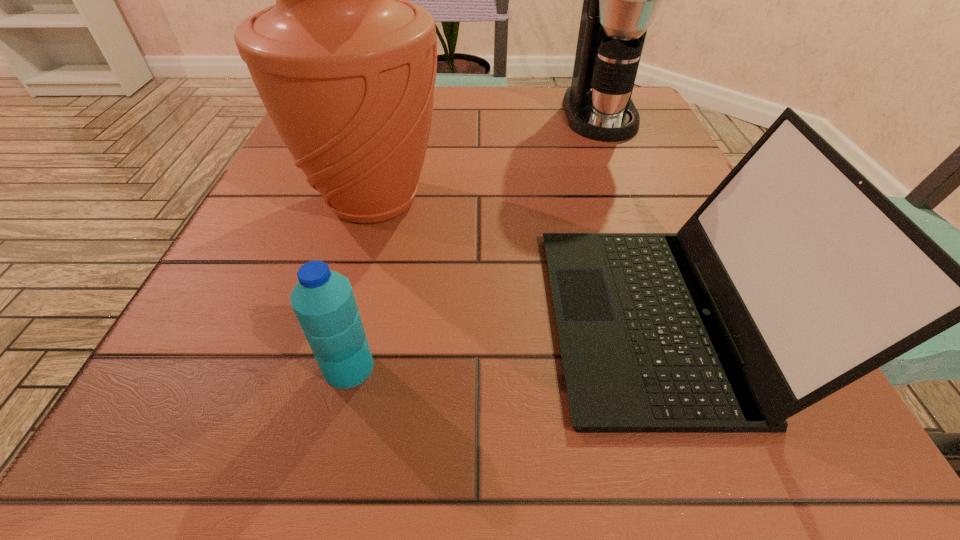
Image resolution: width=960 pixels, height=540 pixels. Find the location of `the farthest object`. the farthest object is located at coordinates (620, 0).

Identify the location of vase. (346, 67).

Locate an element on the screen. The width and height of the screenshot is (960, 540). laptop is located at coordinates (796, 277).

Locate an element on the screen. Image resolution: width=960 pixels, height=540 pixels. water bottle is located at coordinates (323, 301).

This screenshot has width=960, height=540. Find the location of `free point located 0.250m place cup under the spout of the farthest object`. free point located 0.250m place cup under the spout of the farthest object is located at coordinates (641, 219).

Locate an element on the screen. free space located on the front of the vase is located at coordinates (323, 382).

I want to click on vacant space located 0.360m on the surface of the laptop, so click(x=278, y=318).

Locate an element on the screen. The height and width of the screenshot is (540, 960). free space located on the surface of the laptop is located at coordinates (309, 318).

Find the location of a particular element. vacant area located 0.120m on the surface of the laptop is located at coordinates (462, 318).

The image size is (960, 540). Identify the location of vacant position located 0.220m on the back of the water bottle. (381, 232).